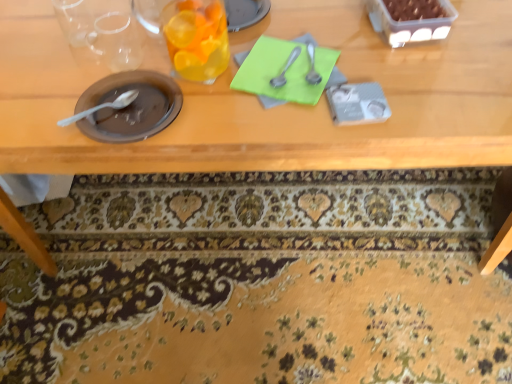
In order to click on free space that is to the left of green paper at center in this screenshot , I will do point(176,92).